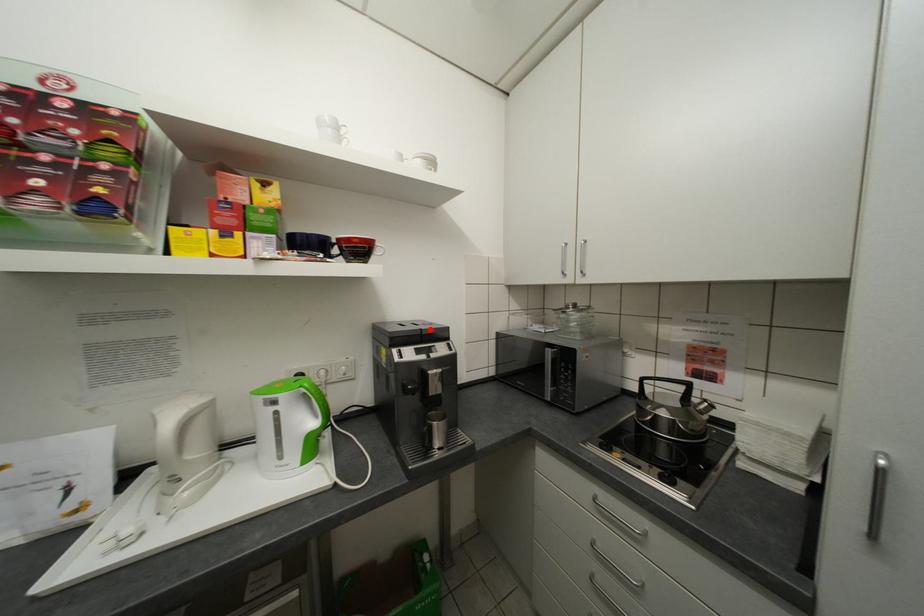
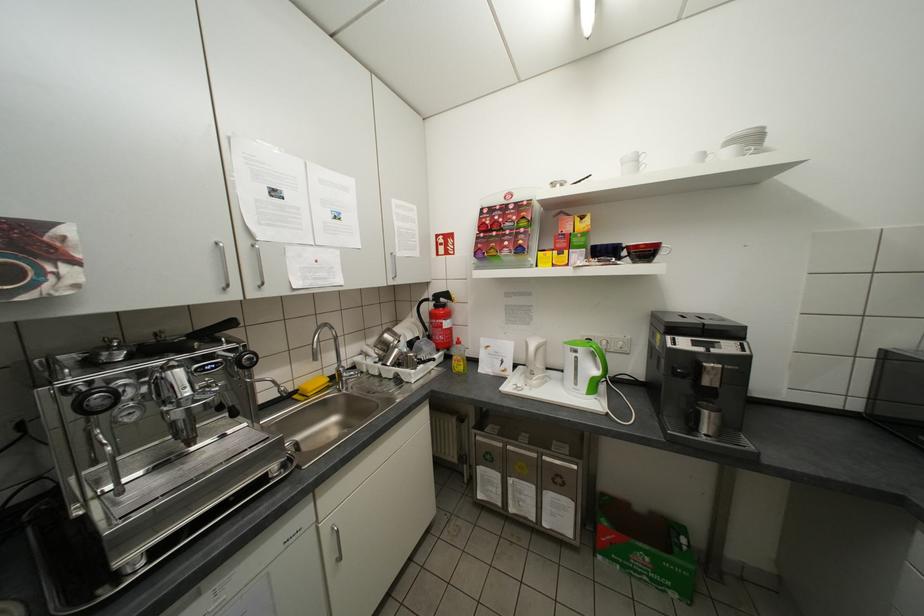
Locate, in the second image, the point that corresponds to the highlighted location in the first image.

(712, 323)